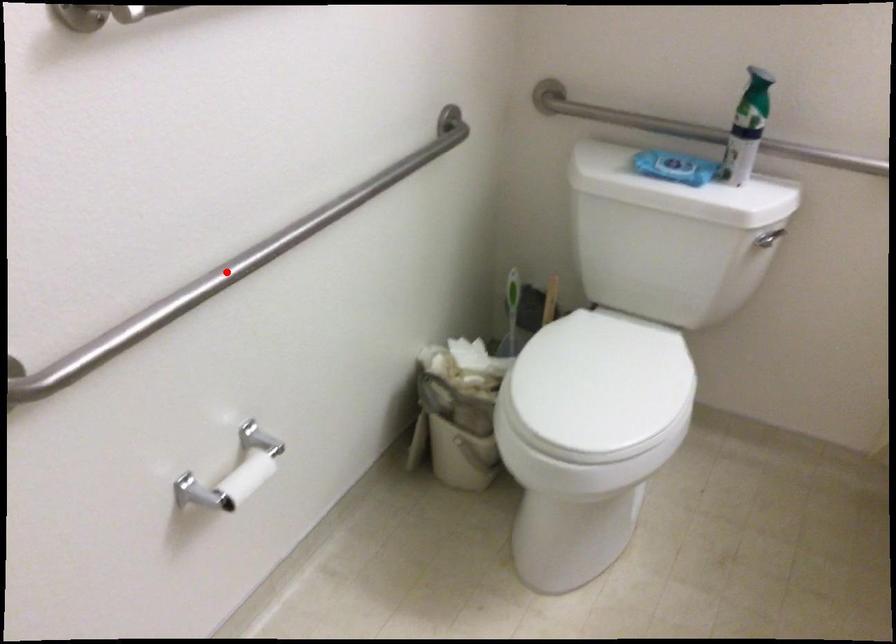
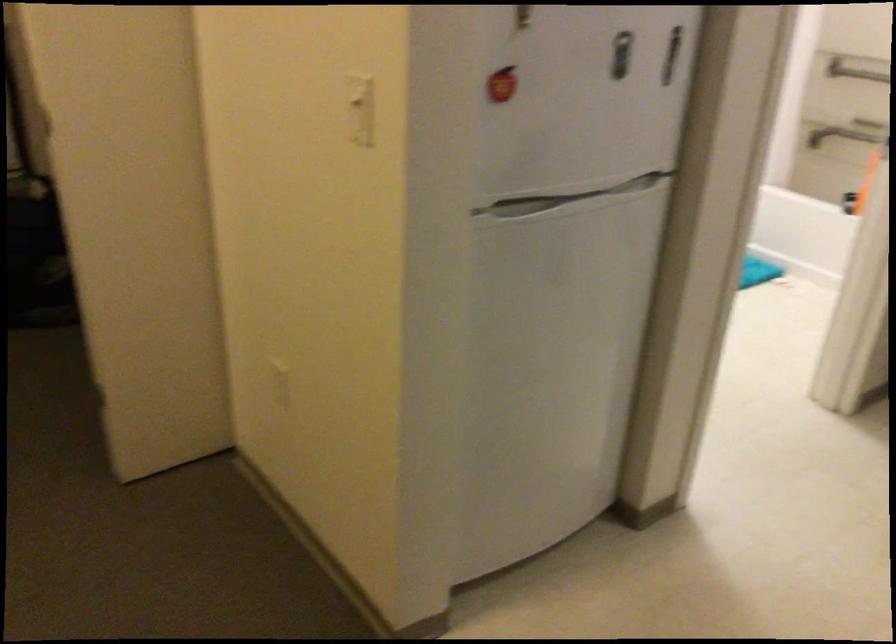
Question: I am providing you with two images of the same scene from different viewpoints. A red point is marked on the first image. Can you still see the location of the red point in image 2?

Choices:
 (A) Yes
 (B) No

Answer: (B)